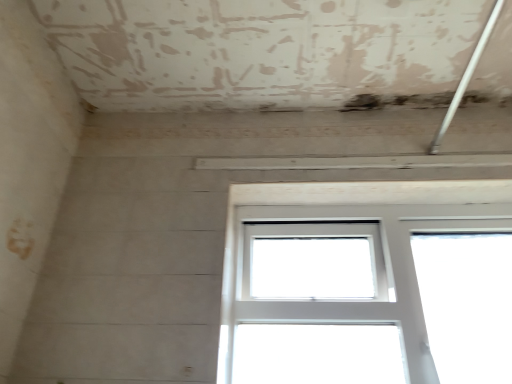
Describe the element at coordinates (316, 221) in the screenshot. I see `white plastic window at center` at that location.

Locate an element on the screen. The height and width of the screenshot is (384, 512). white plastic window at center is located at coordinates (316, 221).

Image resolution: width=512 pixels, height=384 pixels. Identify the location of white plastic window at center. (316, 221).